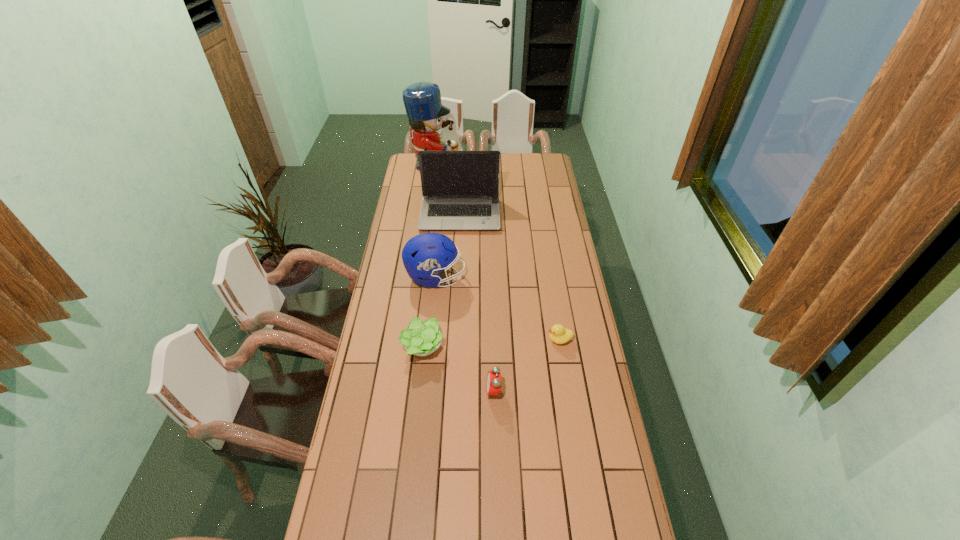
The width and height of the screenshot is (960, 540). I want to click on vacant space located 0.290m on the front-facing side of the tallest object, so click(509, 167).

Locate an element on the screen. This screenshot has width=960, height=540. free point located 0.160m on the screen of the second farthest object is located at coordinates (458, 255).

Identify the location of free space located 0.240m on the front-facing side of the third farthest object. Image resolution: width=960 pixels, height=540 pixels. (520, 277).

This screenshot has width=960, height=540. In order to click on vacant space located on the front-facing side of the nearest object in this screenshot , I will do `click(471, 392)`.

The width and height of the screenshot is (960, 540). I want to click on vacant space located on the front-facing side of the nearest object, so click(x=400, y=392).

Where is `free space located on the front-facing side of the nearest object`? This screenshot has height=540, width=960. free space located on the front-facing side of the nearest object is located at coordinates (452, 392).

Find the location of `free location located 0.390m on the back of the lettuce`. free location located 0.390m on the back of the lettuce is located at coordinates (432, 262).

Where is `vacant area situated on the beak of the rightmost object`? The image size is (960, 540). vacant area situated on the beak of the rightmost object is located at coordinates (477, 340).

Identify the location of free space located on the beak of the rightmost object. (482, 340).

Identify the location of vacant space located on the beak of the rightmost object. This screenshot has width=960, height=540. (467, 340).